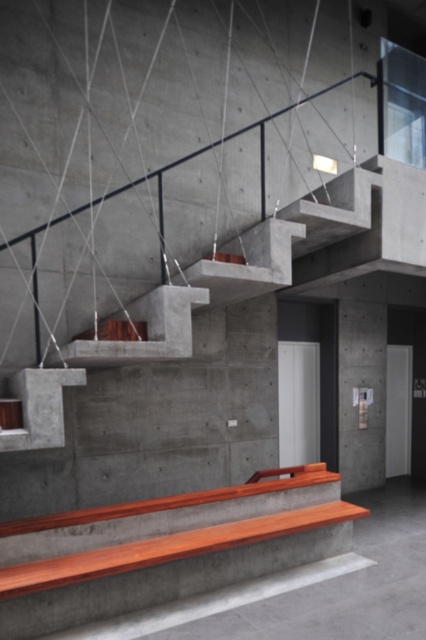
Question: Which point is closer to the camera?

Choices:
 (A) (244, 269)
 (B) (143, 600)

Answer: (B)

Question: Is polished wood bench at lower center to the right of concrete/stained wood stairs at center from the viewer's perspective?

Choices:
 (A) no
 (B) yes

Answer: (B)

Question: Is polished wood bench at lower center bigger than concrete/stained wood stairs at center?

Choices:
 (A) yes
 (B) no

Answer: (B)

Question: Does polished wood bench at lower center have a larger size compared to concrete/stained wood stairs at center?

Choices:
 (A) yes
 (B) no

Answer: (B)